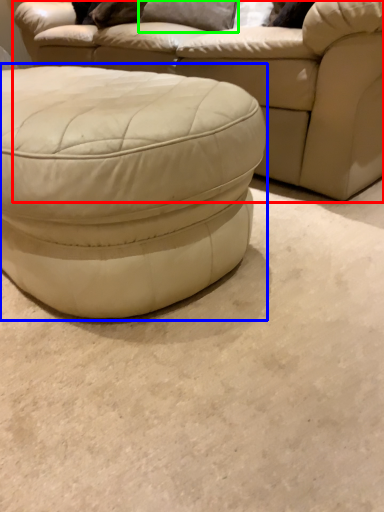
Question: Which is farther away from studio couch (highlighted by a red box)? stool (highlighted by a blue box) or pillow (highlighted by a green box)?

Choices:
 (A) stool
 (B) pillow

Answer: (A)